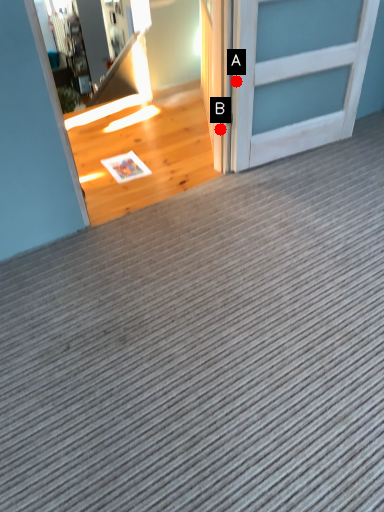
Question: Two points are circled on the image, labeled by A and B beside each circle. Which point is closer to the camera?

Choices:
 (A) A is closer
 (B) B is closer

Answer: (A)